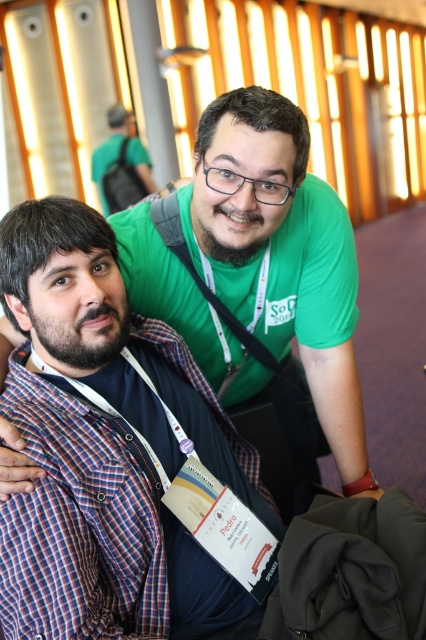
Question: Which of these objects is positioned closest to the matte green shirt at upper center?

Choices:
 (A) green matte shirt at upper center
 (B) plaid cotton shirt at left

Answer: (A)

Question: Can you confirm if green matte shirt at upper center is thinner than matte green shirt at upper center?

Choices:
 (A) yes
 (B) no

Answer: (A)

Question: Can you confirm if green matte shirt at upper center is positioned above plaid cotton shirt at left?

Choices:
 (A) no
 (B) yes

Answer: (B)

Question: Which point is closer to the camera?

Choices:
 (A) (62, 451)
 (B) (135, 291)

Answer: (A)

Question: Does green matte shirt at upper center appear on the right side of matte green shirt at upper center?

Choices:
 (A) yes
 (B) no

Answer: (A)

Question: Considering the real-world distances, which object is closest to the plaid cotton shirt at left?

Choices:
 (A) green matte shirt at upper center
 (B) matte green shirt at upper center

Answer: (A)